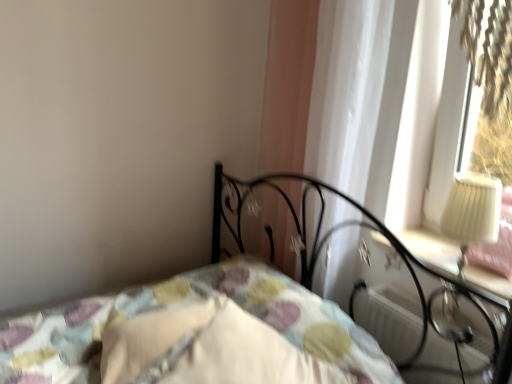
Question: In terms of width, does white soft pillow at lower center, which is counted as the 1th pillow, starting from the left, look wider or thinner when compared to patterned fabric bed at center?

Choices:
 (A) wide
 (B) thin

Answer: (B)

Question: Is point (217, 302) closer or farther from the camera than point (152, 372)?

Choices:
 (A) farther
 (B) closer

Answer: (A)

Question: Based on their relative distances, which object is farther from the white sheer curtain at upper right?

Choices:
 (A) white plastic radiator at lower right
 (B) white soft pillow at center, marked as the 2th pillow in a left-to-right arrangement
 (C) patterned fabric bed at center
 (D) white soft pillow at lower center, the 2th pillow in the right-to-left sequence

Answer: (D)

Question: Based on their relative distances, which object is nearer to the white sheer curtain at upper right?

Choices:
 (A) white plastic radiator at lower right
 (B) patterned fabric bed at center
 (C) white soft pillow at center, the first pillow when ordered from right to left
 (D) white soft pillow at lower center, the 2th pillow in the right-to-left sequence

Answer: (B)